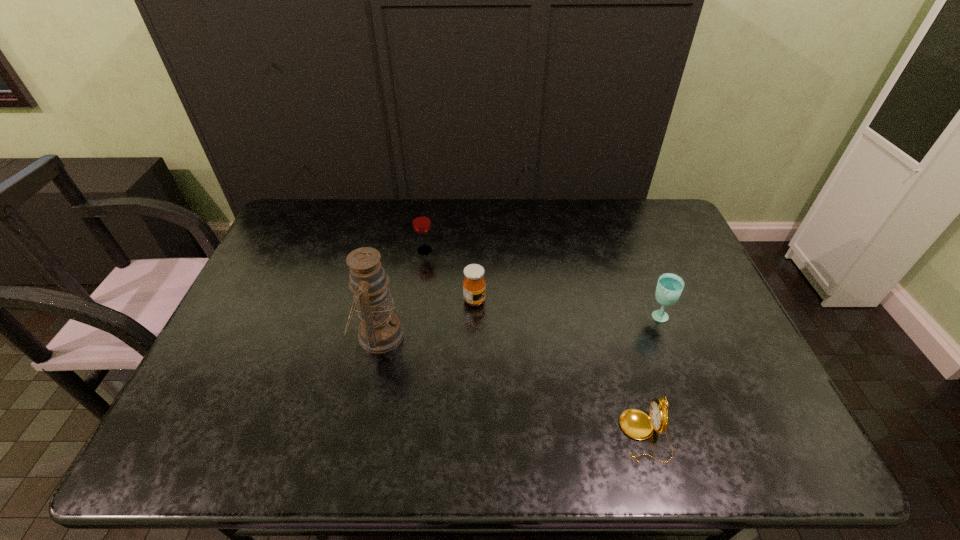
This screenshot has width=960, height=540. In the image, there is a desktop. In order to click on free space at the right edge in this screenshot , I will do `click(676, 258)`.

Locate an element on the screen. This screenshot has height=540, width=960. blank area at the far right corner is located at coordinates (653, 207).

Locate an element on the screen. This screenshot has height=540, width=960. free space between the rightmost object and the honey is located at coordinates (566, 308).

Find the location of `unoccupied area between the farthest object and the nearer glass`. unoccupied area between the farthest object and the nearer glass is located at coordinates (541, 284).

In order to click on free spot between the nearest object and the tallest object in this screenshot , I will do `click(512, 385)`.

Where is `vacant area that lies between the pocket watch and the oil lamp`? The image size is (960, 540). vacant area that lies between the pocket watch and the oil lamp is located at coordinates (512, 385).

Find the location of a particular element. This screenshot has height=540, width=960. free space between the second object from right to left and the tallest object is located at coordinates (512, 385).

Locate an element on the screen. The width and height of the screenshot is (960, 540). vacant area between the nearer glass and the honey is located at coordinates (566, 308).

The height and width of the screenshot is (540, 960). What are the coordinates of `vacant space that's between the pocket watch and the tallest object` in the screenshot? It's located at (512, 385).

Locate an element on the screen. This screenshot has width=960, height=540. unoccupied position between the farther glass and the fourth object from left to right is located at coordinates (535, 343).